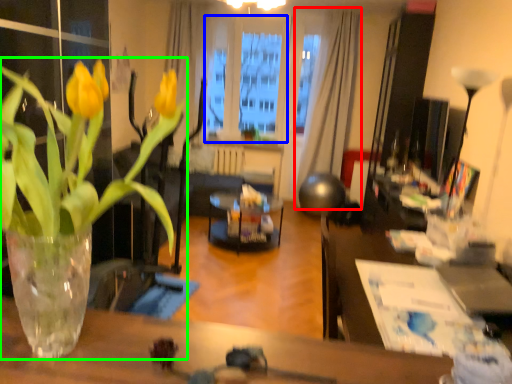
Question: Considering the real-world distances, which object is farthest from curtain (highlighted by a red box)? window screen (highlighted by a blue box) or houseplant (highlighted by a green box)?

Choices:
 (A) window screen
 (B) houseplant

Answer: (B)